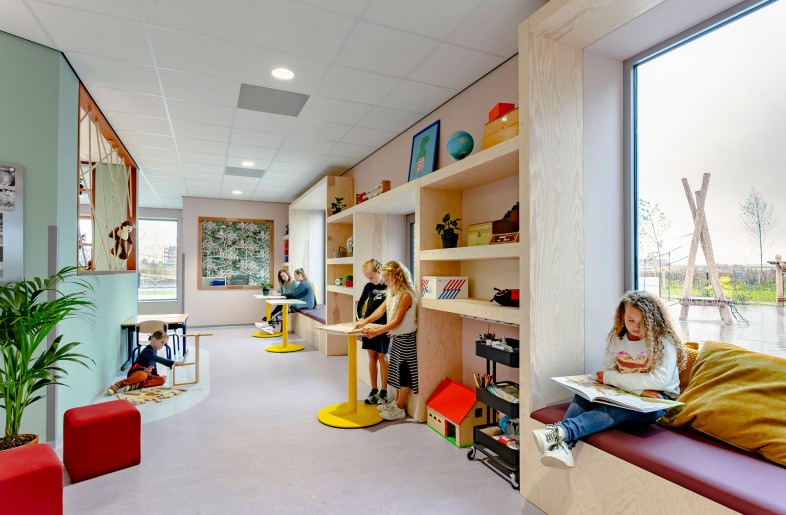
Identify the location of windows. The width and height of the screenshot is (786, 515). (715, 247).